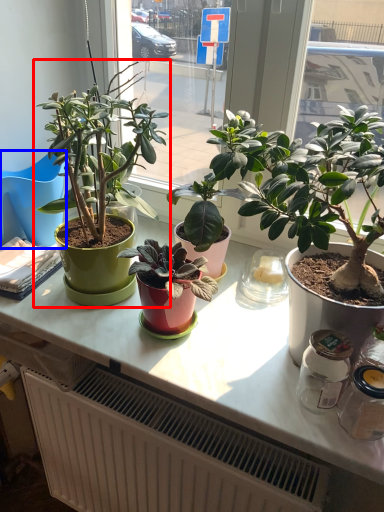
Question: Among these objects, which one is nearest to the camera, houseplant (highlighted by a red box) or chair (highlighted by a blue box)?

Choices:
 (A) houseplant
 (B) chair

Answer: (A)